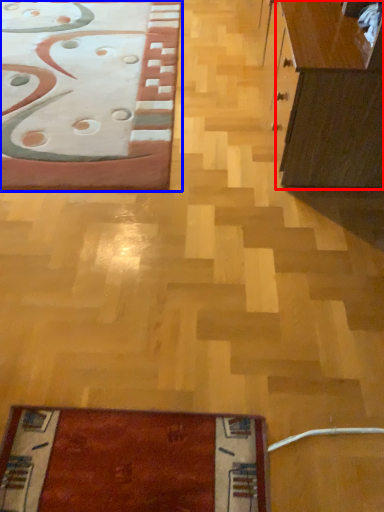
Question: Which object is closer to the camera taking this photo, cabinetry (highlighted by a red box) or furniture (highlighted by a blue box)?

Choices:
 (A) cabinetry
 (B) furniture

Answer: (A)